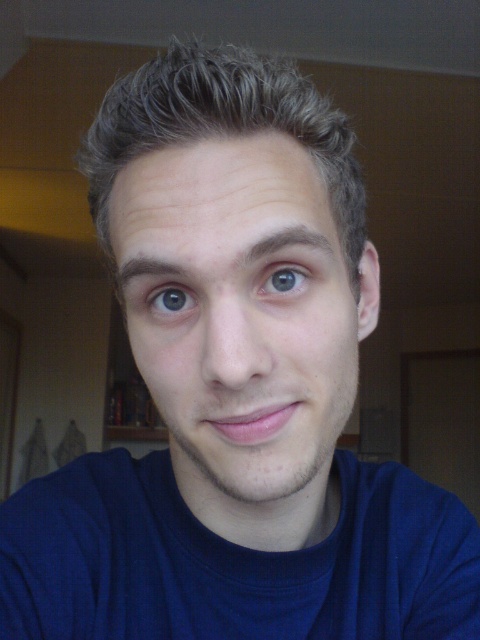
Question: Which point appears farthest from the camera in this image?

Choices:
 (A) (264, 579)
 (B) (354, 204)

Answer: (A)

Question: Is smooth skin face at center positioned at the back of light brown textured hair at center?

Choices:
 (A) no
 (B) yes

Answer: (A)

Question: Estimate the real-world distances between objects in this image. Which object is closer to the smooth skin face at center?

Choices:
 (A) blue cotton shirt at center
 (B) blue matte eye at center

Answer: (B)

Question: Can you confirm if smooth skin face at center is thinner than light brown textured hair at center?

Choices:
 (A) no
 (B) yes

Answer: (B)

Question: Which point is closer to the camera?

Choices:
 (A) (294, 284)
 (B) (328, 332)
 (C) (439, 554)
 (D) (344, 138)

Answer: (A)

Question: Does smooth skin face at center have a lesser width compared to light brown textured hair at center?

Choices:
 (A) no
 (B) yes

Answer: (B)